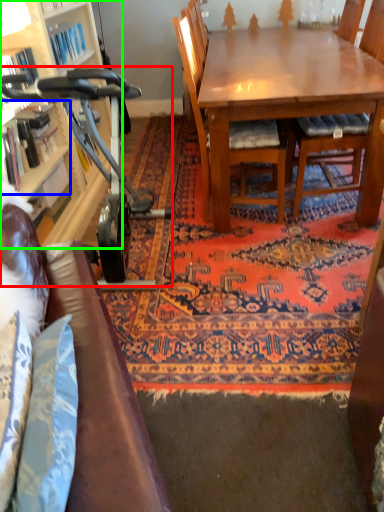
Question: Which is farther away from baby carriage (highlighted by a red box)? shelf (highlighted by a blue box) or cabinetry (highlighted by a green box)?

Choices:
 (A) shelf
 (B) cabinetry

Answer: (B)